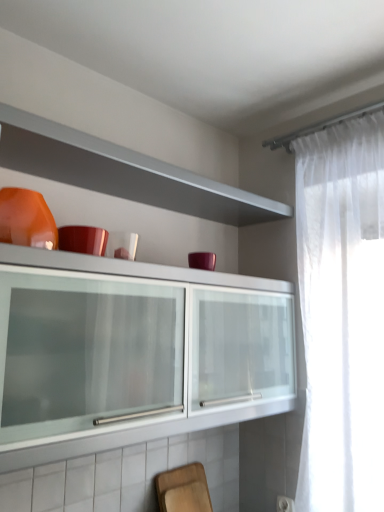
Question: Does matte orange bowl at upper left have a lesser height compared to wooden cutting board at lower center?

Choices:
 (A) no
 (B) yes

Answer: (B)

Question: Considering the relative sizes of matte orange bowl at upper left and wooden cutting board at lower center in the image provided, is matte orange bowl at upper left thinner than wooden cutting board at lower center?

Choices:
 (A) no
 (B) yes

Answer: (A)

Question: Does matte orange bowl at upper left contain wooden cutting board at lower center?

Choices:
 (A) no
 (B) yes

Answer: (A)

Question: Is matte orange bowl at upper left further to the viewer compared to wooden cutting board at lower center?

Choices:
 (A) no
 (B) yes

Answer: (A)

Question: Considering the relative positions of matte orange bowl at upper left and wooden cutting board at lower center in the image provided, is matte orange bowl at upper left to the right of wooden cutting board at lower center from the viewer's perspective?

Choices:
 (A) no
 (B) yes

Answer: (A)

Question: Are matte orange bowl at upper left and wooden cutting board at lower center making contact?

Choices:
 (A) no
 (B) yes

Answer: (A)

Question: Is there a large distance between wooden cutting board at lower center and matte orange bowl at upper left?

Choices:
 (A) yes
 (B) no

Answer: (A)

Question: Can you confirm if wooden cutting board at lower center is shorter than matte orange bowl at upper left?

Choices:
 (A) no
 (B) yes

Answer: (A)

Question: Considering the relative sizes of wooden cutting board at lower center and matte orange bowl at upper left in the image provided, is wooden cutting board at lower center wider than matte orange bowl at upper left?

Choices:
 (A) yes
 (B) no

Answer: (B)

Question: From a real-world perspective, does wooden cutting board at lower center stand above matte orange bowl at upper left?

Choices:
 (A) yes
 (B) no

Answer: (B)

Question: Can you confirm if wooden cutting board at lower center is smaller than matte orange bowl at upper left?

Choices:
 (A) no
 (B) yes

Answer: (B)

Question: Could you tell me if wooden cutting board at lower center is facing matte orange bowl at upper left?

Choices:
 (A) no
 (B) yes

Answer: (A)

Question: Considering the positions of wooden cutting board at lower center and matte orange bowl at upper left in the image, is wooden cutting board at lower center taller or shorter than matte orange bowl at upper left?

Choices:
 (A) tall
 (B) short

Answer: (A)